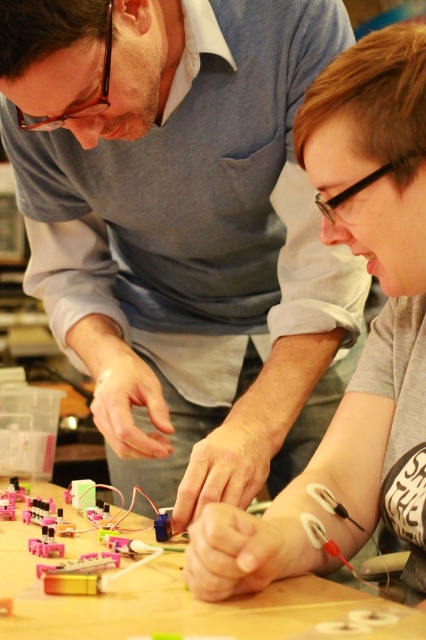
Looking at this image, you are a photographer positioned at the origin point. You need to capture a closeup of the matte gray sweater at upper left. Which direction should you move your camera to focus on it?

The matte gray sweater at upper left is located at point 0.361 on the x and 0.430 on the y, so you should move your camera to the upper left direction to focus on it.

You are a tailor measuring the distance between two garments for a fitting. The garments are the matte gray sweater at upper left and the gray matte shirt at center. Can you fit a 10 inch ruler between them?

The distance between the matte gray sweater at upper left and the gray matte shirt at center is 10.57 inches, so yes, the 10 inch ruler can fit between them since it is shorter than the available space.

You are a photographer standing in front of the scene described. You want to take a photo that includes both the matte gray sweater at upper left and the gray matte shirt at center. Which object should you focus on to ensure both are in frame without moving the camera?

The matte gray sweater at upper left is much taller than the gray matte shirt at center, so focusing on the taller object will ensure both are in frame.